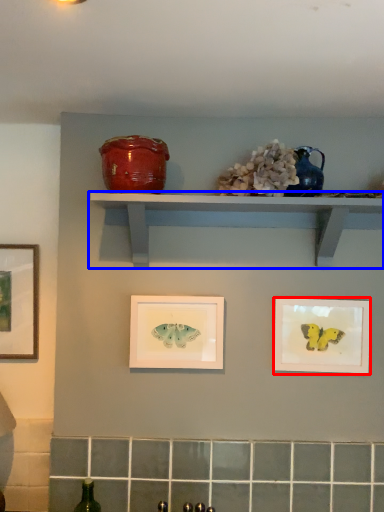
Question: Which point is closer to the camera, picture frame (highlighted by a red box) or shelf (highlighted by a blue box)?

Choices:
 (A) picture frame
 (B) shelf

Answer: (B)